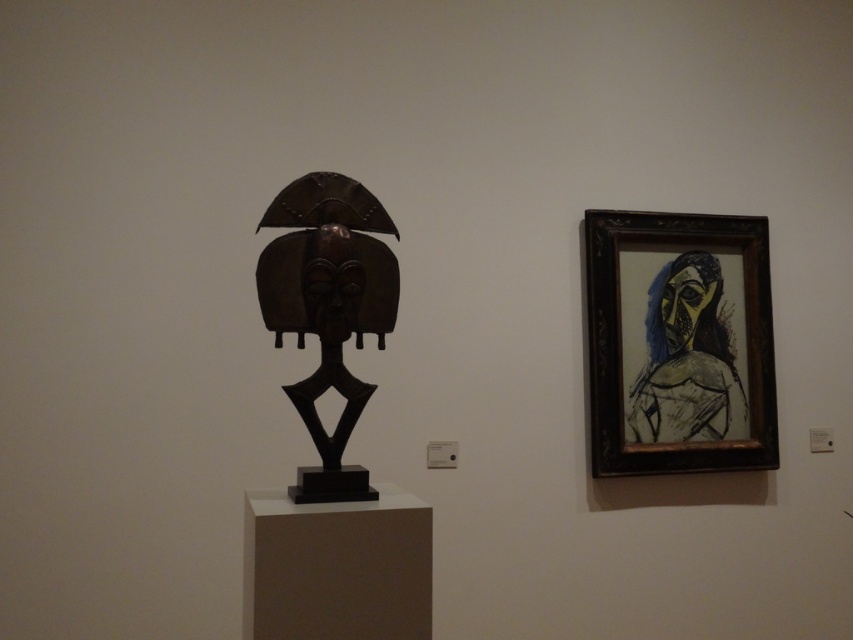
Question: Can you confirm if wooden framed portrait at right is positioned below yellowish sketch at right?

Choices:
 (A) yes
 (B) no

Answer: (B)

Question: Is shiny brown wood mask at left below yellowish sketch at right?

Choices:
 (A) no
 (B) yes

Answer: (A)

Question: Which point appears closest to the camera in this image?

Choices:
 (A) (366, 493)
 (B) (605, 388)

Answer: (A)

Question: From the image, what is the correct spatial relationship of wooden framed portrait at right in relation to shiny brown wood mask at left?

Choices:
 (A) right
 (B) left

Answer: (A)

Question: Which point is closer to the camera?

Choices:
 (A) (292, 202)
 (B) (741, 412)
 (C) (752, 243)

Answer: (A)

Question: Which point is farther to the camera?

Choices:
 (A) wooden framed portrait at right
 (B) shiny brown wood mask at left

Answer: (A)